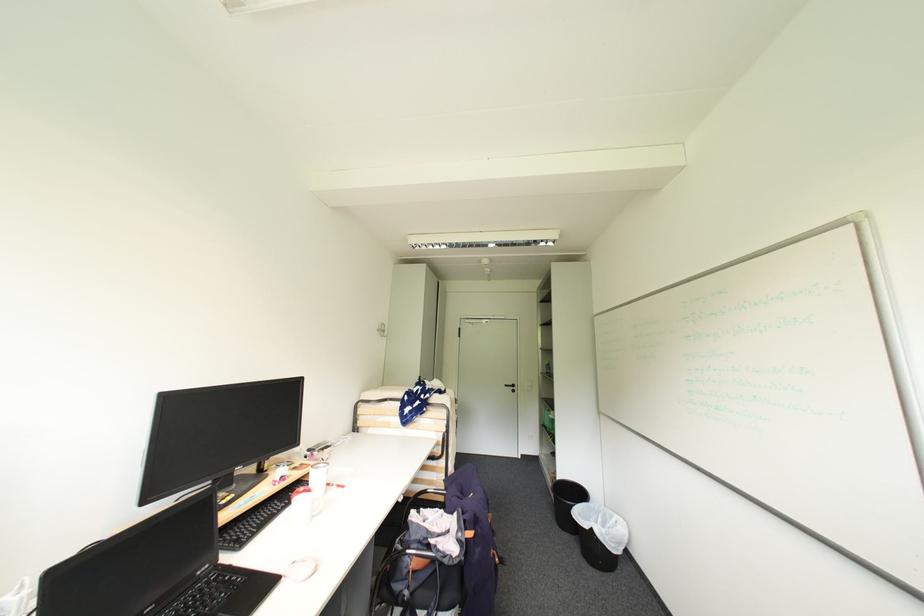
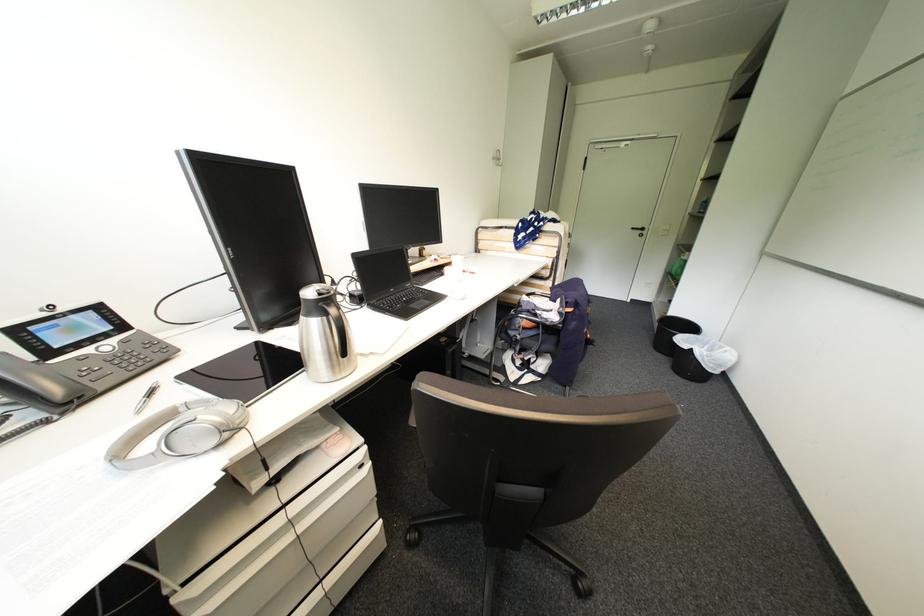
First-person continuous shooting, in which direction is the camera rotating?

The camera rotated toward left-down.